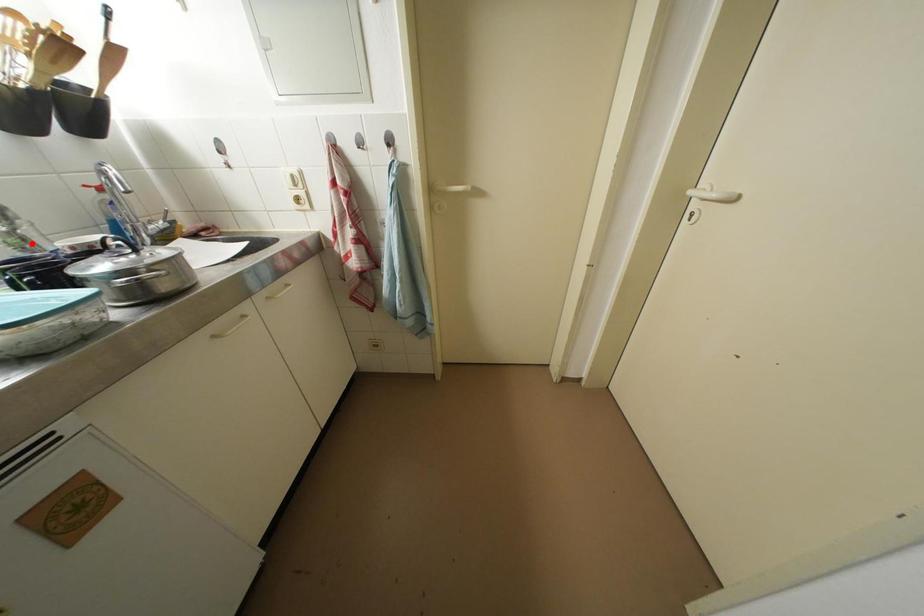
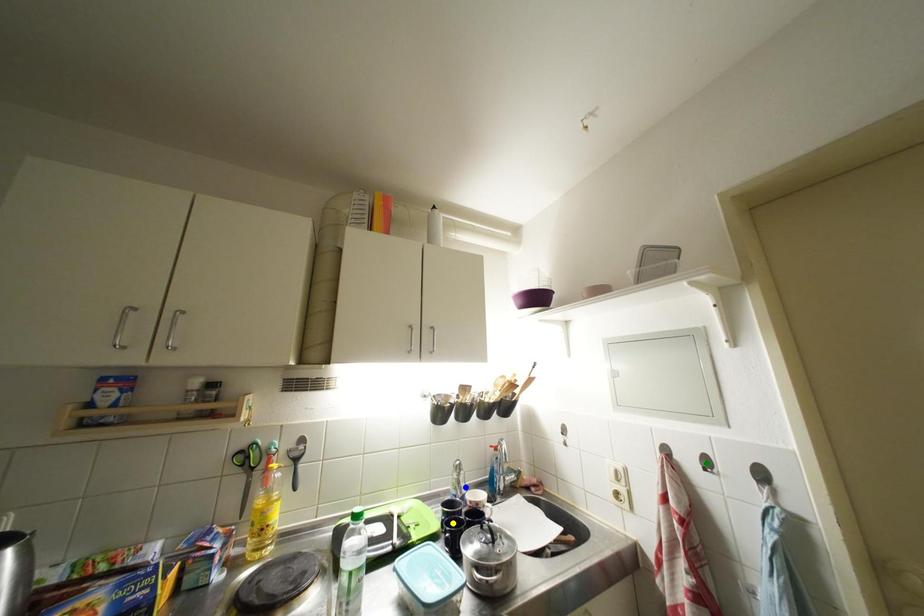
Question: I am providing you with two images of the same scene from different viewpoints. A red point is marked on the first image. You are given multiple points on the second image. Which point in image 2 represents the same 3d spot as the red point in image 1?

Choices:
 (A) green point
 (B) blue point
 (C) yellow point

Answer: (B)